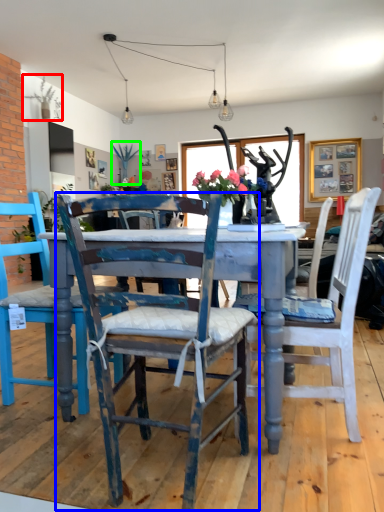
Question: Considering the real-world distances, which object is closest to plant (highlighted by a red box)? chair (highlighted by a blue box) or plant (highlighted by a green box).

Choices:
 (A) chair
 (B) plant

Answer: (B)